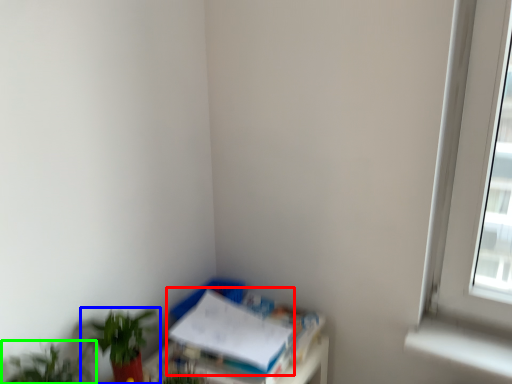
Question: Based on their relative distances, which object is nearer to paperback book (highlighted by a red box)? Choose from houseplant (highlighted by a blue box) and houseplant (highlighted by a green box).

Choices:
 (A) houseplant
 (B) houseplant

Answer: (A)